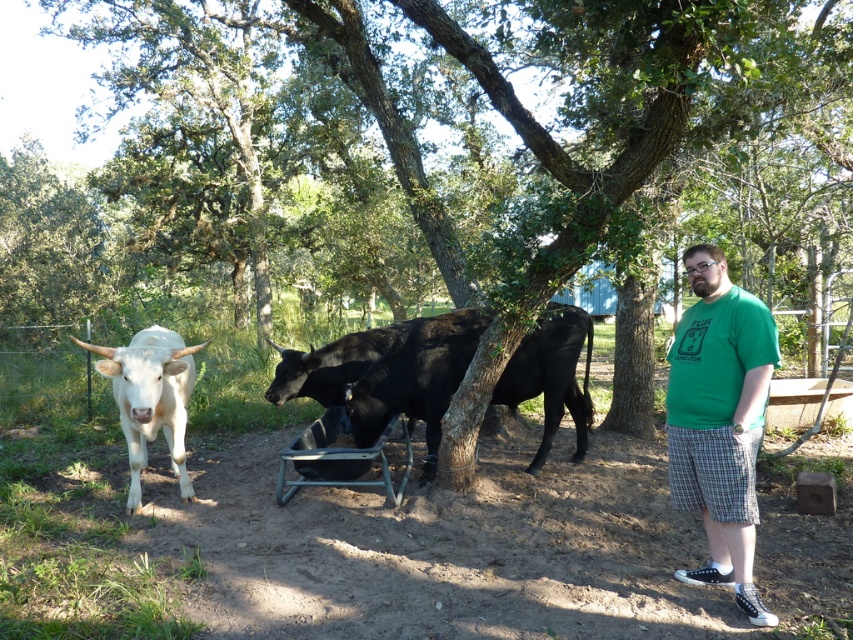
Question: Is black glossy bull at center wider than metallic gray cart at center?

Choices:
 (A) yes
 (B) no

Answer: (A)

Question: Which object appears farthest from the camera in this image?

Choices:
 (A) green t-shirt at right
 (B) green leafy tree at center
 (C) black glossy bull at center

Answer: (C)

Question: Which object appears closest to the camera in this image?

Choices:
 (A) metallic gray cart at center
 (B) green t-shirt at right

Answer: (B)

Question: Which point is closer to the camera?

Choices:
 (A) (640, 388)
 (B) (341, 449)
 (C) (717, 445)
 (D) (560, 355)

Answer: (C)

Question: Does green leafy tree at center have a smaller size compared to metallic gray cart at center?

Choices:
 (A) no
 (B) yes

Answer: (A)

Question: Is green t-shirt at right further to camera compared to black glossy bull at center?

Choices:
 (A) no
 (B) yes

Answer: (A)